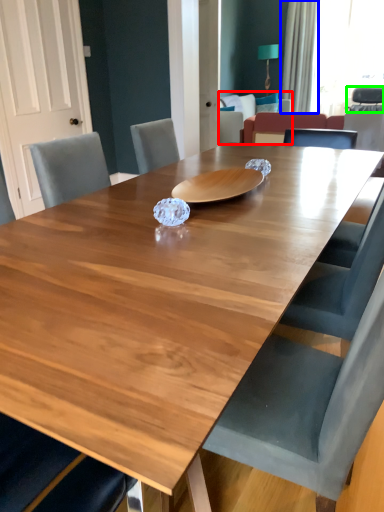
Question: Which object is the closest to the armchair (highlighted by a red box)? Choose among these: curtain (highlighted by a blue box) or armchair (highlighted by a green box).

Choices:
 (A) curtain
 (B) armchair

Answer: (A)